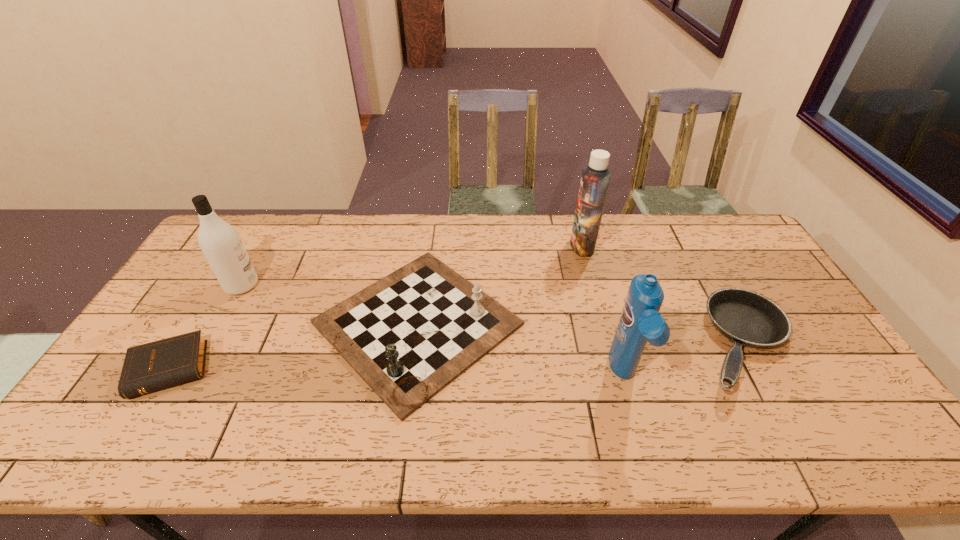
The height and width of the screenshot is (540, 960). Identify the location of free space between the farthest shampoo and the nearest shampoo. (604, 311).

Locate an element on the screen. empty space between the farthest shampoo and the fourth tallest object is located at coordinates (500, 285).

I want to click on object that can be found as the second closest to the second farthest shampoo, so click(x=409, y=335).

Find the location of a particular element. The image size is (960, 540). object that is the fifth closest to the leftmost shampoo is located at coordinates (746, 318).

Identify the location of shampoo that is the second closest to the shortest object. (640, 321).

Locate an element on the screen. This screenshot has width=960, height=540. the second closest shampoo to the farthest shampoo is located at coordinates (220, 243).

The image size is (960, 540). In order to click on free space that satisfies the following two spatial constraints: 1. on the front-facing side of the nearest shampoo; 2. on the right side of the second farthest shampoo in this screenshot , I will do `click(190, 377)`.

At what (x,y) coordinates should I click in order to perform the action: click on free spot that satisfies the following two spatial constraints: 1. on the front-facing side of the nearest shampoo; 2. on the right side of the leftmost shampoo. Please return your answer as a coordinate pair (x, y). The width and height of the screenshot is (960, 540). Looking at the image, I should click on (190, 377).

Where is `free point that satisfies the following two spatial constraints: 1. on the front-facing side of the leftmost shampoo; 2. on the back side of the second shortest object`? The width and height of the screenshot is (960, 540). free point that satisfies the following two spatial constraints: 1. on the front-facing side of the leftmost shampoo; 2. on the back side of the second shortest object is located at coordinates (208, 344).

This screenshot has width=960, height=540. Identify the location of vacant space that satisfies the following two spatial constraints: 1. on the front label of the farthest shampoo; 2. on the right side of the nearest shampoo. (617, 377).